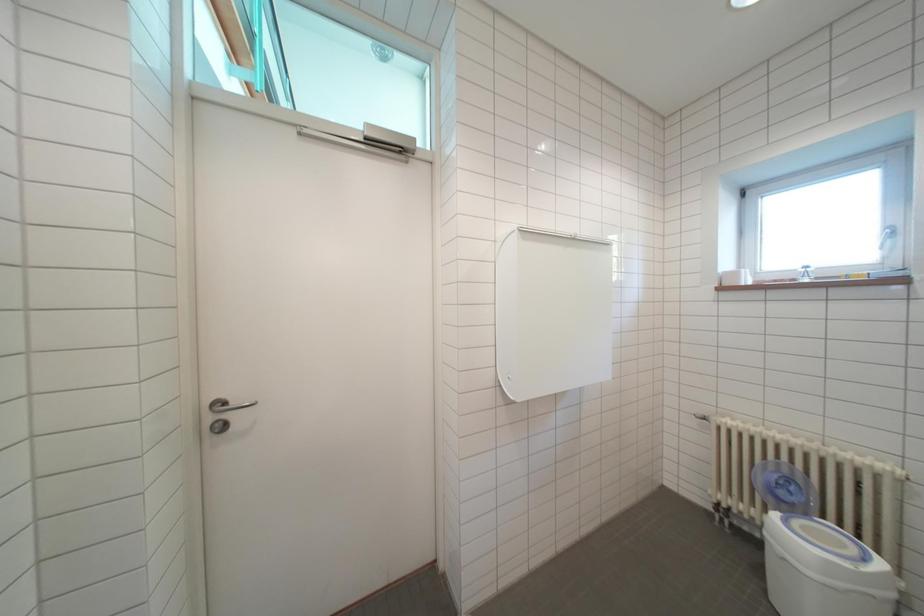
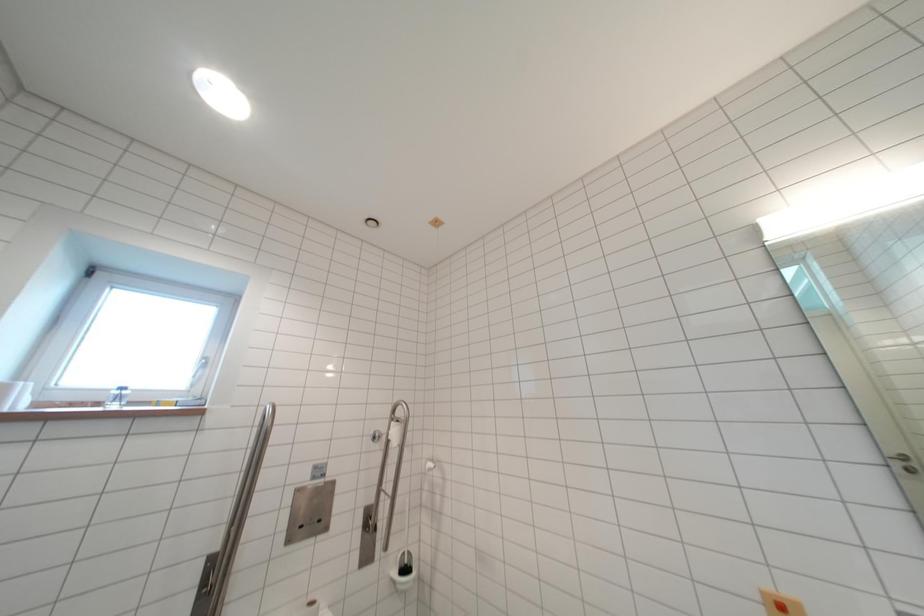
Looking at this image, how did the camera likely rotate?

The rotation direction of the camera is right-up.